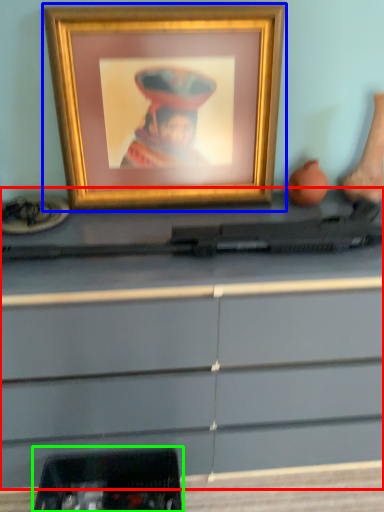
Question: Considering the real-world distances, which object is farthest from desk (highlighted by a red box)? picture frame (highlighted by a blue box) or equipment (highlighted by a green box)?

Choices:
 (A) picture frame
 (B) equipment

Answer: (A)